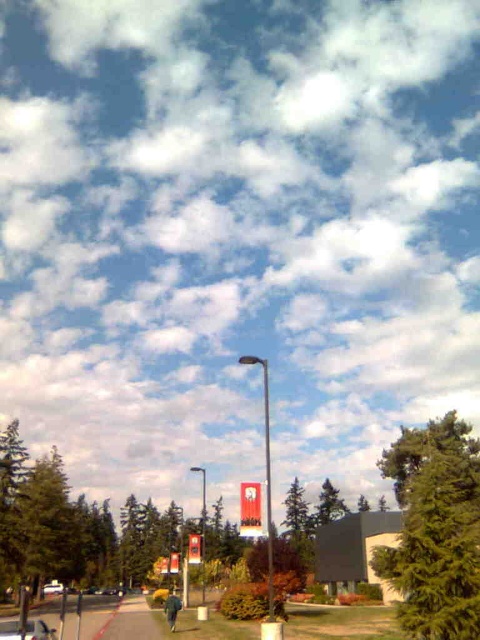
Question: Which object is positioned closest to the white glossy car at center?

Choices:
 (A) metallic silver car at lower left
 (B) green textured tree at right

Answer: (B)

Question: Among these objects, which one is farthest from the camera?

Choices:
 (A) metallic silver car at lower left
 (B) green fabric jacket at lower center

Answer: (B)

Question: Which object is positioned closest to the metallic silver car at lower left?

Choices:
 (A) white glossy car at center
 (B) green textured tree at right

Answer: (B)

Question: From the image, what is the correct spatial relationship of green textured tree at right in relation to metallic silver car at lower left?

Choices:
 (A) left
 (B) right

Answer: (B)

Question: Is green textured tree at right positioned in front of metallic silver car at lower left?

Choices:
 (A) yes
 (B) no

Answer: (B)

Question: Observing the image, what is the correct spatial positioning of metallic silver car at lower left in reference to green fabric jacket at lower center?

Choices:
 (A) above
 (B) below

Answer: (A)